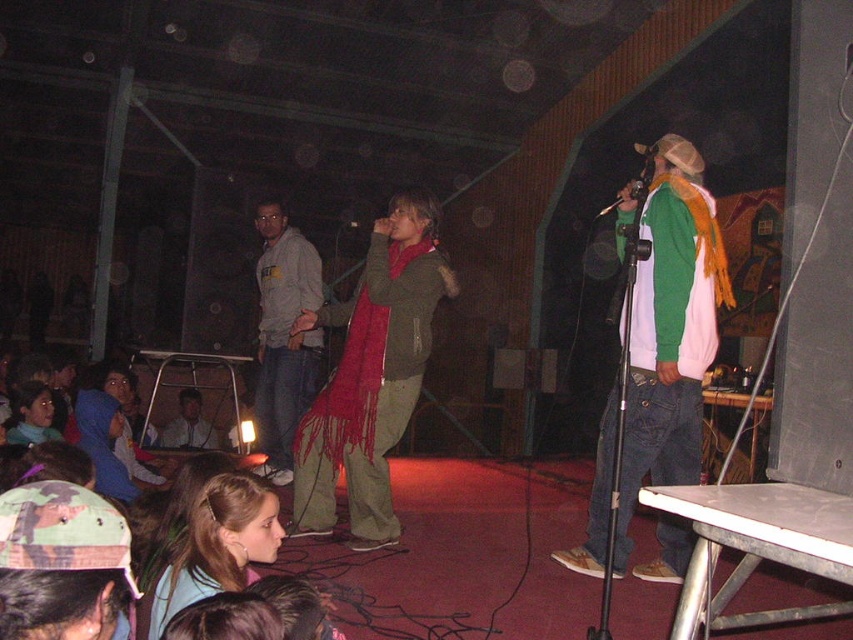
Does matte red scarf at center have a smaller size compared to blue denim jacket at lower left?

Yes.

Identify the location of matte red scarf at center. The height and width of the screenshot is (640, 853). (370, 378).

Describe the element at coordinates (370, 378) in the screenshot. The width and height of the screenshot is (853, 640). I see `matte red scarf at center` at that location.

Where is `matte red scarf at center`? The width and height of the screenshot is (853, 640). matte red scarf at center is located at coordinates (370, 378).

In the scene shown: Which of these two, green fleece jacket at center or matte gray hoodie at center, stands taller?

Standing taller between the two is green fleece jacket at center.

Can you confirm if green fleece jacket at center is thinner than matte gray hoodie at center?

In fact, green fleece jacket at center might be wider than matte gray hoodie at center.

This screenshot has height=640, width=853. I want to click on green fleece jacket at center, so click(x=668, y=324).

Find the location of a particular element. matte gray hoodie at center is located at coordinates (283, 337).

What are the coordinates of `matte gray hoodie at center` in the screenshot? It's located at (283, 337).